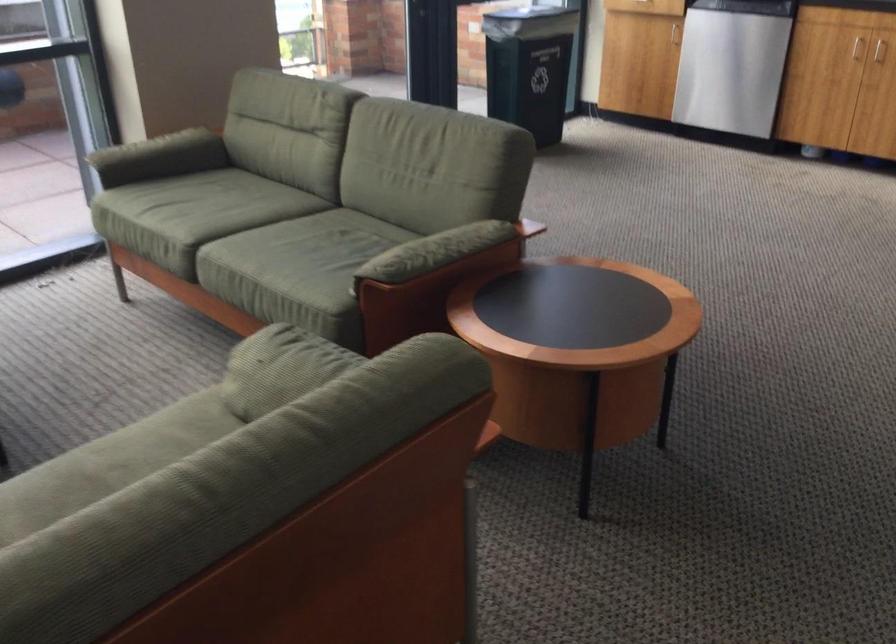
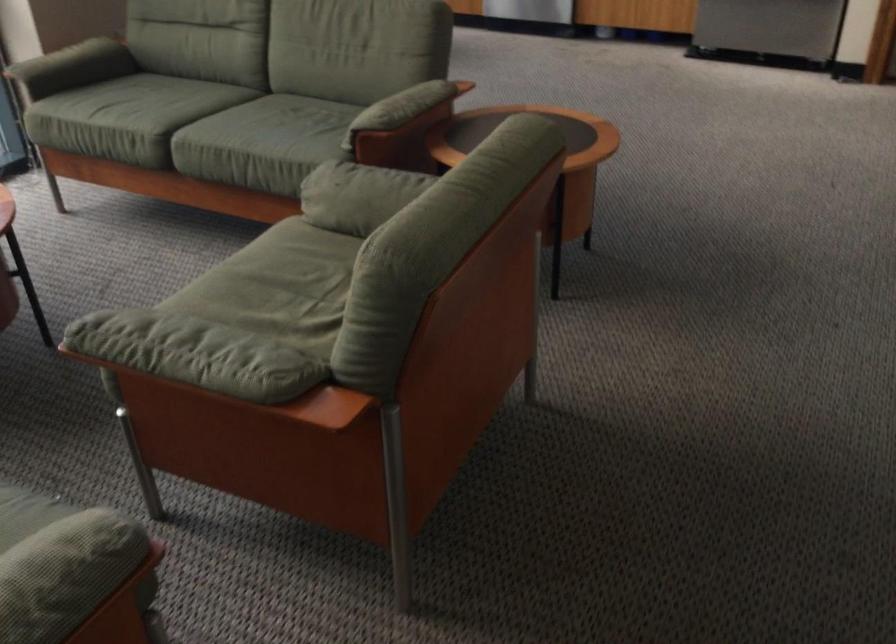
In the second image, find the point that corresponds to [171,450] in the first image.

(289, 260)